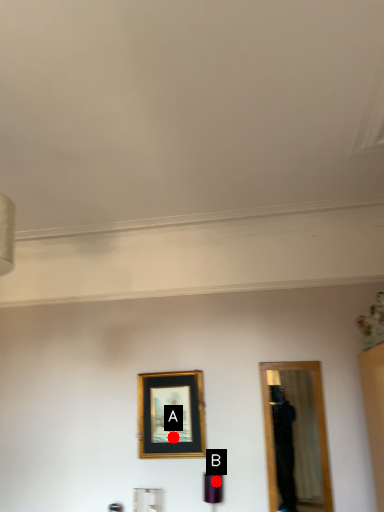
Question: Two points are circled on the image, labeled by A and B beside each circle. Which of the following is the closest to the observer?

Choices:
 (A) A is closer
 (B) B is closer

Answer: (B)